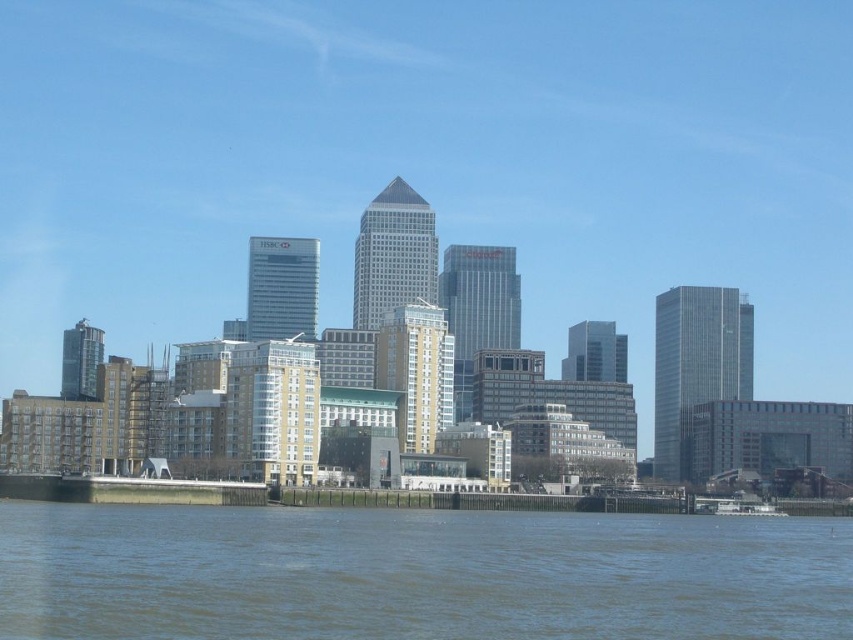
Question: Does brown water at lower center appear over white matte boat at lower right?

Choices:
 (A) yes
 (B) no

Answer: (A)

Question: Does brown water at lower center come in front of white matte boat at lower right?

Choices:
 (A) no
 (B) yes

Answer: (B)

Question: Which of the following is the farthest from the observer?

Choices:
 (A) (291, 627)
 (B) (773, 509)

Answer: (B)

Question: Among these objects, which one is farthest from the camera?

Choices:
 (A) white matte boat at lower right
 (B) brown water at lower center

Answer: (A)

Question: Does brown water at lower center have a greater width compared to white matte boat at lower right?

Choices:
 (A) no
 (B) yes

Answer: (B)